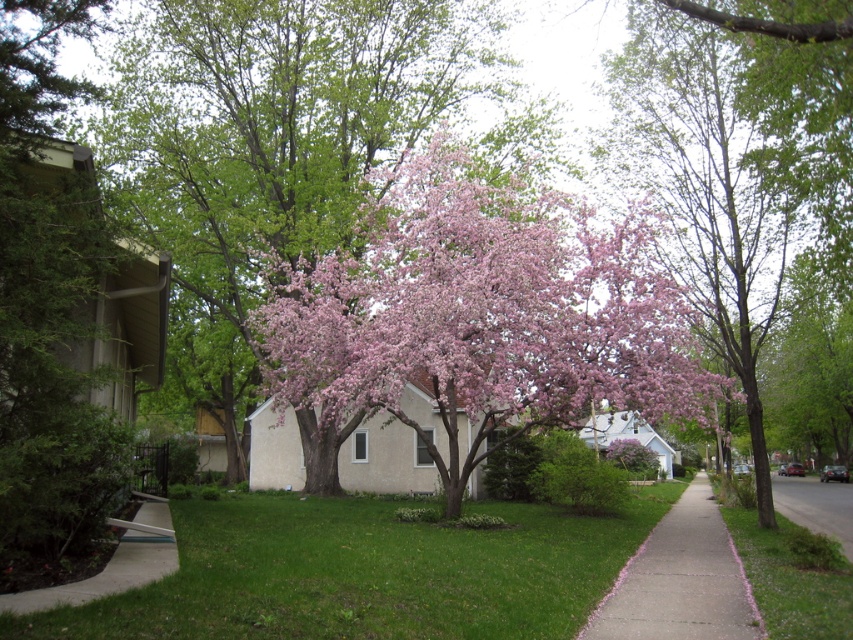
You are standing at the center of the yard and want to take a photo of the pink bloom tree at center. According to the scene description, where should you position yourself relative to the tree to ensure it is centered in your camera frame?

The pink bloom tree at center is already positioned at point (x=277, y=128), so to center it in your camera frame, you should move to a position that aligns with the tree at that coordinate.